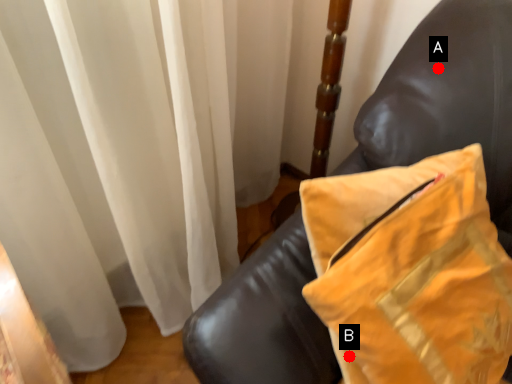
Question: Two points are circled on the image, labeled by A and B beside each circle. Which point is closer to the camera taking this photo?

Choices:
 (A) A is closer
 (B) B is closer

Answer: (B)